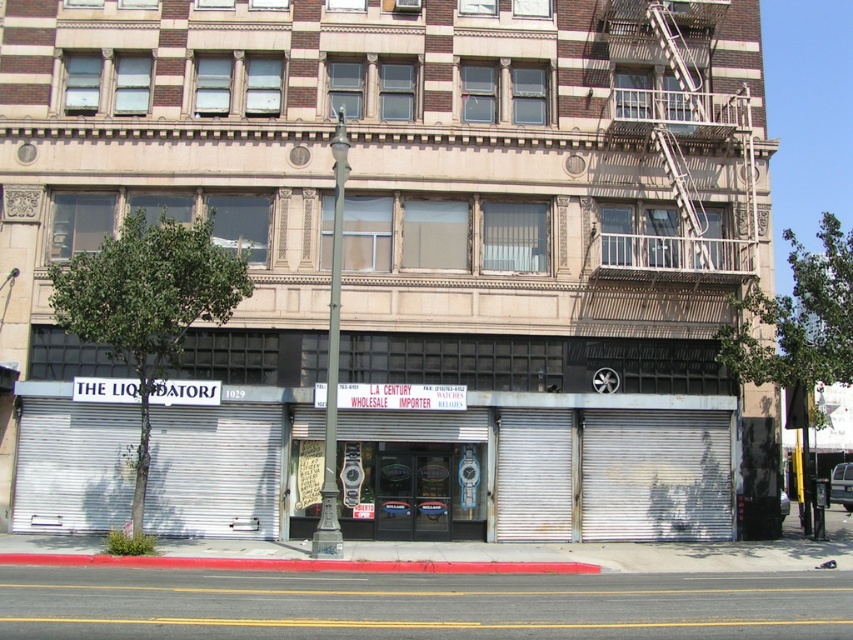
Is silver metallic shutters at center to the left of metallic fire escape at upper right from the viewer's perspective?

Yes, silver metallic shutters at center is to the left of metallic fire escape at upper right.

Is silver metallic shutters at center above metallic fire escape at upper right?

No, silver metallic shutters at center is not above metallic fire escape at upper right.

Which is behind, point (697, 426) or point (660, 125)?

Point (660, 125)

The height and width of the screenshot is (640, 853). Identify the location of silver metallic shutters at center. (554, 465).